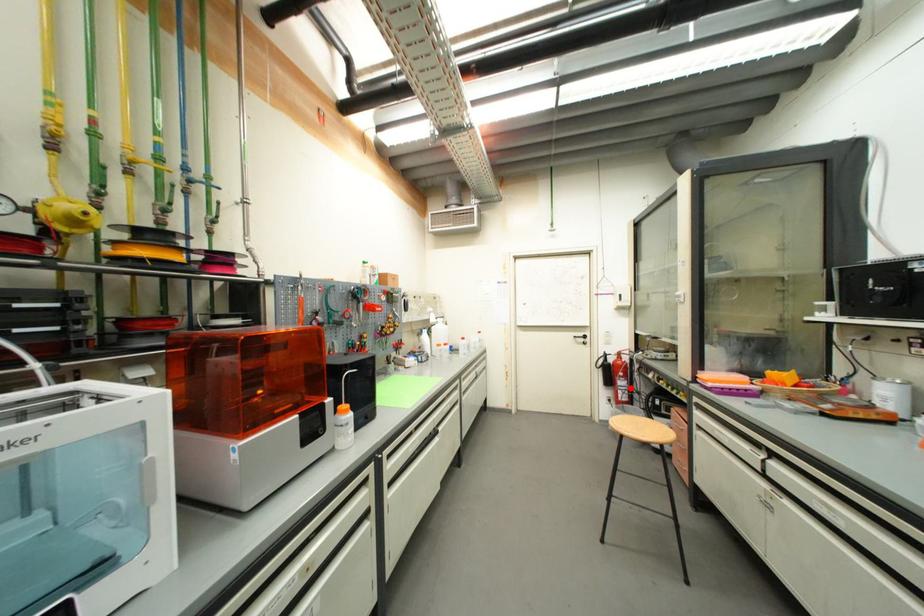
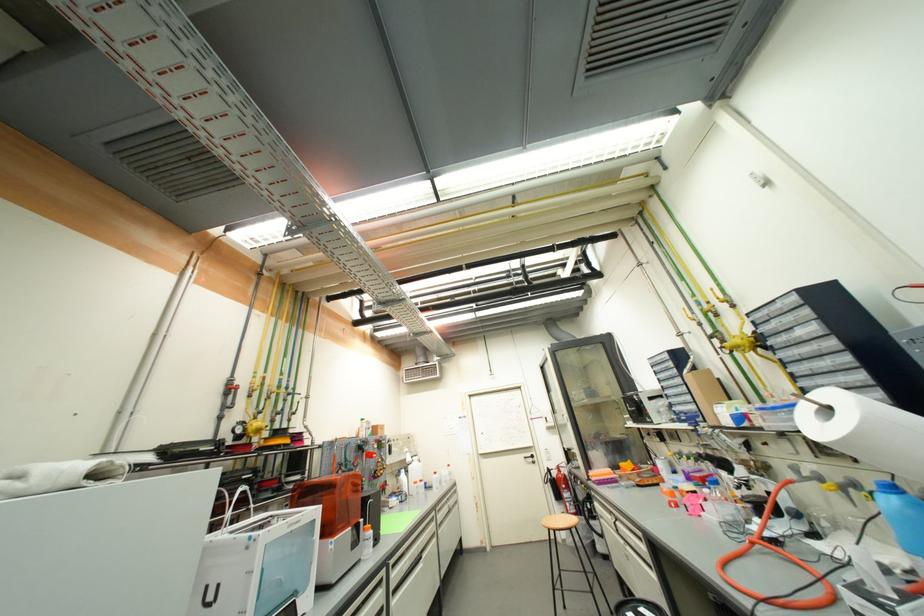
Where in the second image is the point corresponding to the highlighted location from the first image?

(575, 500)